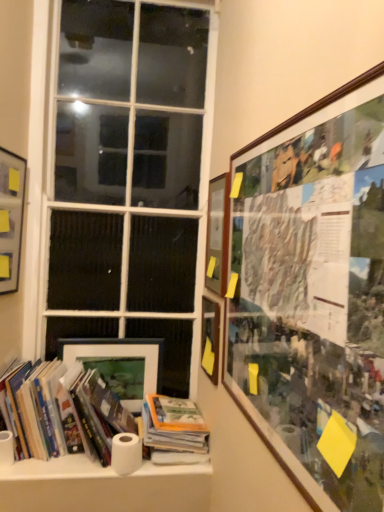
I want to click on free space to the right of white matte paper towel at lower left, so click(49, 459).